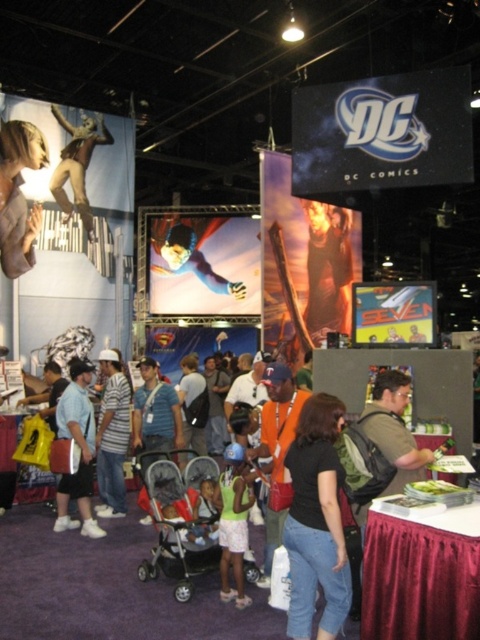
Is point (340, 467) farther from camera compared to point (63, 424)?

No, it is not.

Measure the distance between black matte shirt at center and camera.

3.23 meters

Between point (323, 403) and point (60, 480), which one is positioned behind?

The point (60, 480) is behind.

You are a GUI agent. You are given a task and a screenshot of the screen. Output one action in this format:
    pyautogui.click(x=<x>, y=<y>)
    Task: Click on the black matte shirt at center
    
    Given the screenshot: What is the action you would take?
    pyautogui.click(x=315, y=522)

Can you confirm if black matte shirt at center is positioned to the left of matte black hair at upper left?

No, black matte shirt at center is not to the left of matte black hair at upper left.

Between black matte shirt at center and matte black hair at upper left, which one is positioned higher?

matte black hair at upper left

This screenshot has height=640, width=480. In order to click on black matte shirt at center in this screenshot , I will do `click(315, 522)`.

Does black matte shirt at center appear on the right side of silver metallic stroller at center?

Correct, you'll find black matte shirt at center to the right of silver metallic stroller at center.

Is point (315, 394) less distant than point (192, 540)?

No.

This screenshot has width=480, height=640. Identify the location of black matte shirt at center. (315, 522).